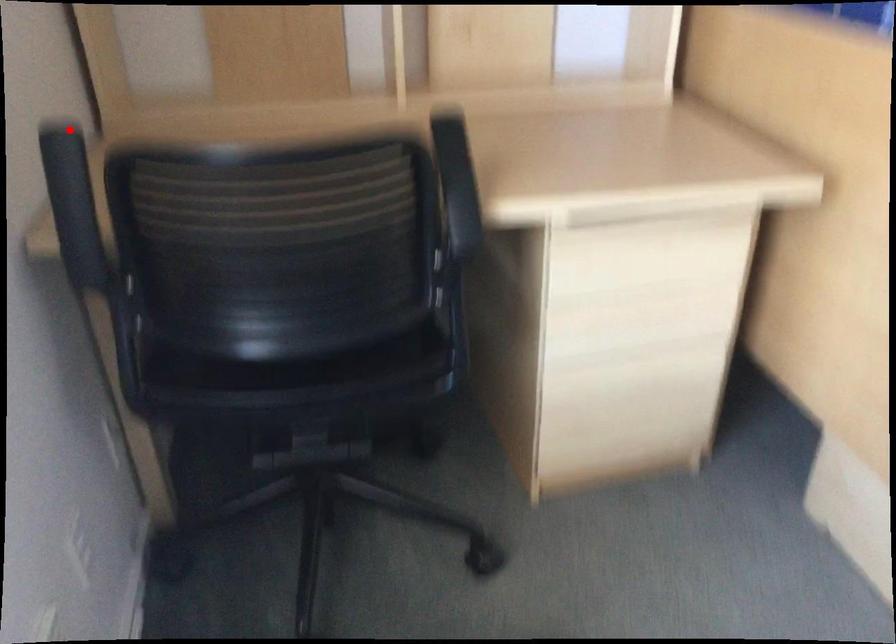
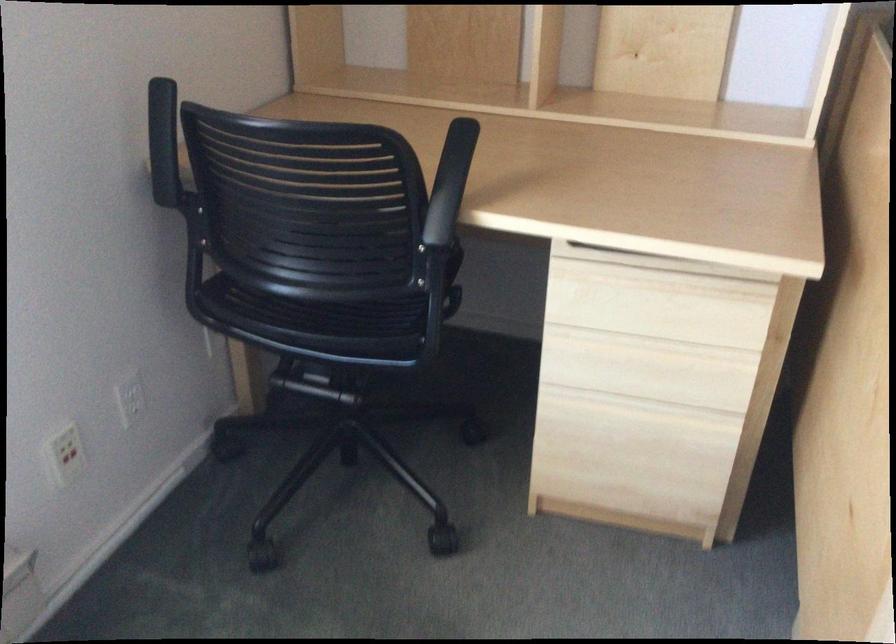
Find the pixel in the second image that matches the highlighted location in the first image.

(162, 88)